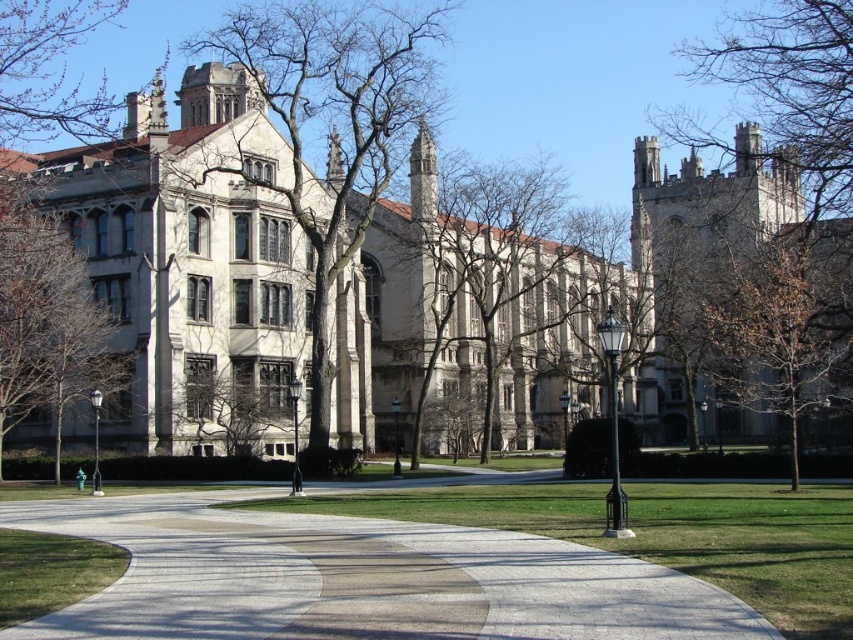
You are a visitor approaching the historic building and notice the brown textured tree at center and the bare branches at left. Which of these two has a wider spread?

The bare branches at left has a wider spread than the brown textured tree at center.

From the picture: You are a visitor planning to take a photo of the grand historic building. You want to ensure both the brown leafless tree at right and the green leafy tree at left are visible in the frame. Which tree will appear wider in the photo?

The brown leafless tree at right will appear wider in the photo because its width surpasses that of the green leafy tree at left.

You are a visitor standing on the pathway facing the historic building. You notice two trees, the brown leafless tree at right and the green leafy tree at left. Which tree is casting a shadow over the other?

The green leafy tree at left is casting a shadow over the brown leafless tree at right because the brown leafless tree at right is positioned under it.